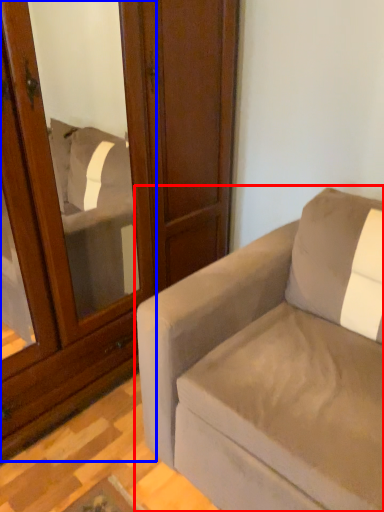
Question: Which object appears closest to the camera in this image, studio couch (highlighted by a red box) or screen door (highlighted by a blue box)?

Choices:
 (A) studio couch
 (B) screen door

Answer: (A)